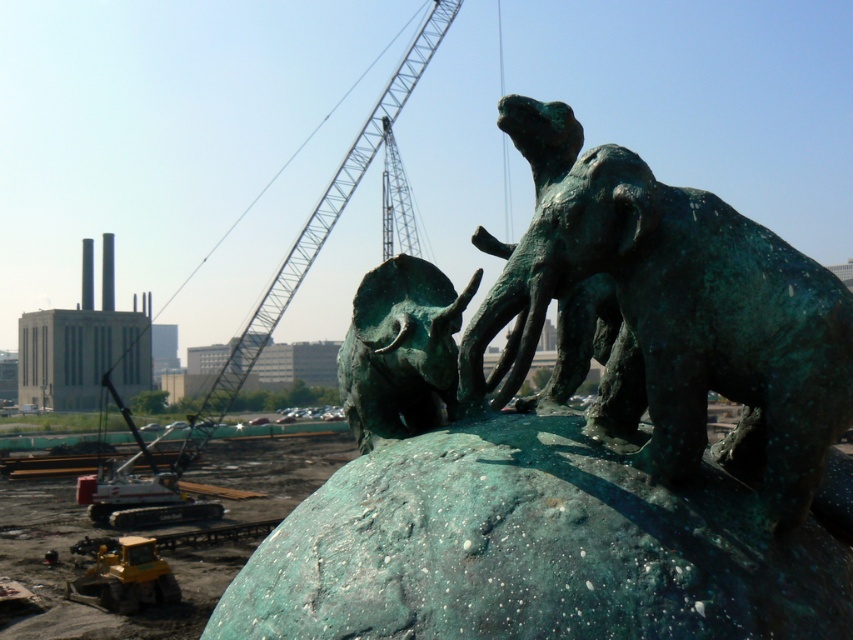
Question: Is green patina bronze elephant at center above green patina bull at center?

Choices:
 (A) no
 (B) yes

Answer: (B)

Question: Which of the following is the farthest from the observer?

Choices:
 (A) pyautogui.click(x=407, y=52)
 (B) pyautogui.click(x=561, y=157)

Answer: (A)

Question: Observing the image, what is the correct spatial positioning of green patina bronze elephant at center in reference to greenish metallic crane at upper center?

Choices:
 (A) above
 (B) below

Answer: (B)

Question: Is green patina bull at center smaller than greenish metallic crane at upper center?

Choices:
 (A) yes
 (B) no

Answer: (A)

Question: Which object is closer to the camera taking this photo?

Choices:
 (A) green patina bull at center
 (B) green patina bronze elephant at center

Answer: (B)

Question: Estimate the real-world distances between objects in this image. Which object is closer to the greenish metallic crane at upper center?

Choices:
 (A) green patina bull at center
 (B) green patina bronze elephant at center

Answer: (A)